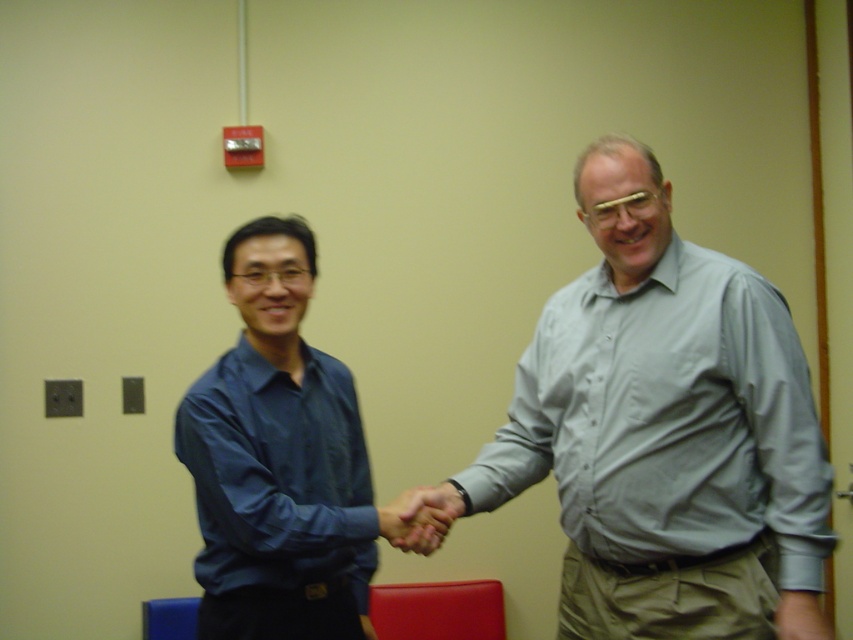
Question: Does light gray shirt at center appear on the left side of matte blue shirt at center?

Choices:
 (A) yes
 (B) no

Answer: (B)

Question: Which is nearer to the smooth skin handshake at center?

Choices:
 (A) light gray shirt at center
 (B) matte blue shirt at center

Answer: (B)

Question: Which point appears closest to the camera in this image?

Choices:
 (A) (721, 365)
 (B) (437, 515)
 (C) (363, 588)

Answer: (A)

Question: Can you confirm if matte blue shirt at center is positioned to the right of smooth skin handshake at center?

Choices:
 (A) no
 (B) yes

Answer: (A)

Question: Is light gray shirt at center positioned in front of smooth skin handshake at center?

Choices:
 (A) yes
 (B) no

Answer: (A)

Question: Estimate the real-world distances between objects in this image. Which object is farther from the matte blue shirt at center?

Choices:
 (A) light gray shirt at center
 (B) smooth skin handshake at center

Answer: (A)